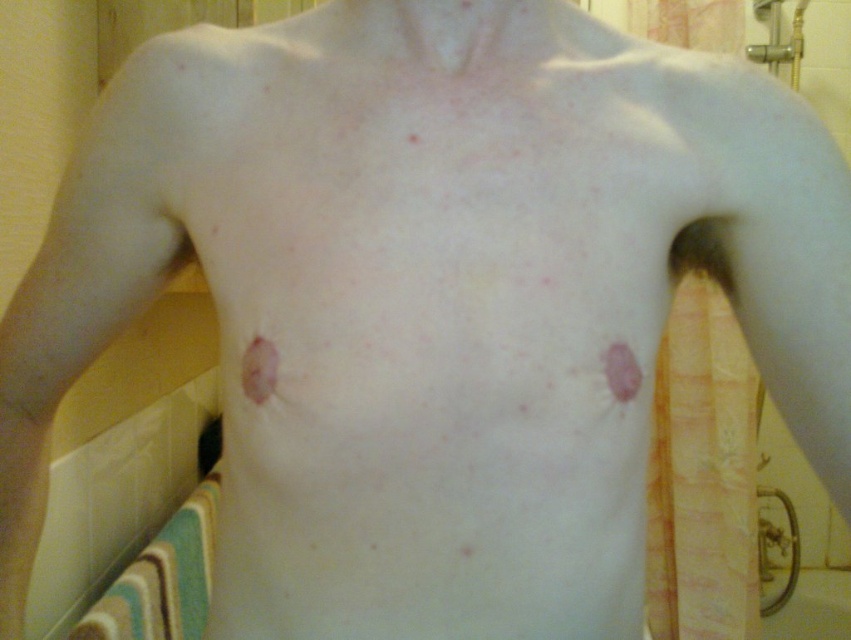
Question: Which point is closer to the camera?

Choices:
 (A) (794, 42)
 (B) (249, 346)
 (C) (640, 380)

Answer: (B)

Question: From the image, what is the correct spatial relationship of metallic silver shower at upper right in relation to pink matte patch at upper right?

Choices:
 (A) right
 (B) left

Answer: (A)

Question: Which is farther from the metallic silver shower at upper right?

Choices:
 (A) pink matte patch at upper right
 (B) pink matte mole at center

Answer: (B)

Question: Among these objects, which one is farthest from the camera?

Choices:
 (A) metallic silver shower at upper right
 (B) pink matte patch at upper right
 (C) pink matte mole at center

Answer: (A)

Question: Can you confirm if pink matte mole at center is positioned below pink matte patch at upper right?

Choices:
 (A) no
 (B) yes

Answer: (A)

Question: In this image, where is metallic silver shower at upper right located relative to pink matte mole at center?

Choices:
 (A) left
 (B) right

Answer: (B)